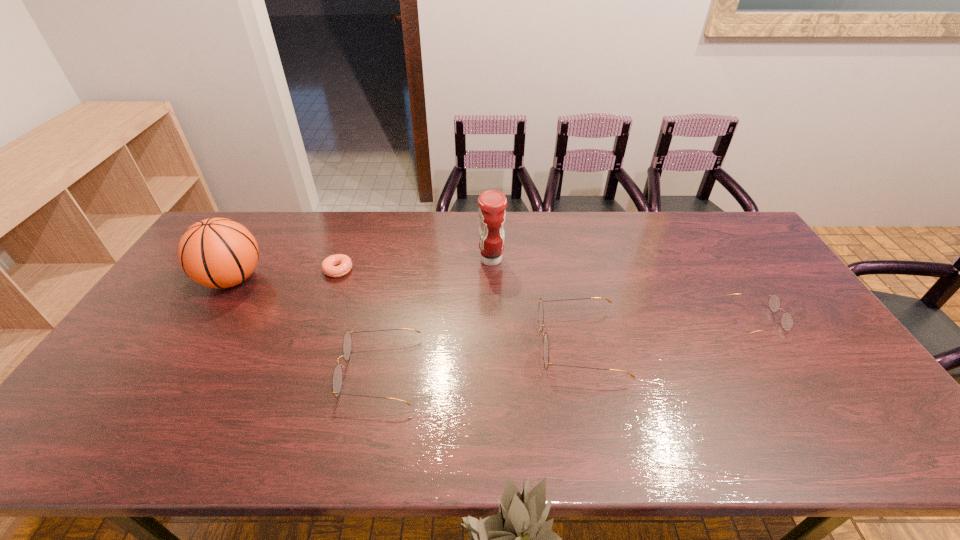
Select which spectacles appears as the closest to the shortest spectacles. Please provide its 2D coordinates. Your answer should be formatted as a tuple, i.e. [(x, y)], where the tuple contains the x and y coordinates of a point satisfying the conditions above.

[(540, 311)]